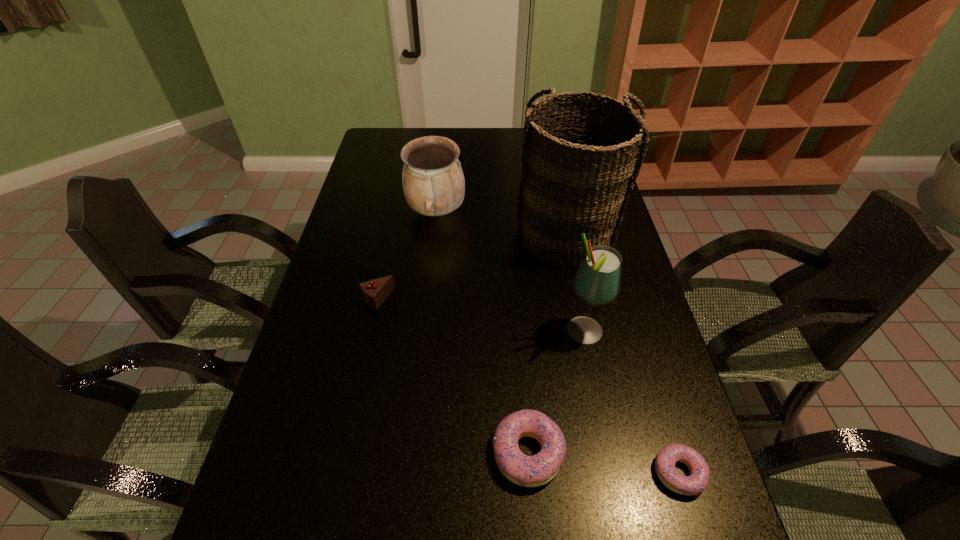
Locate an element on the screen. vacant spot to place a doughnut on the left is located at coordinates (387, 434).